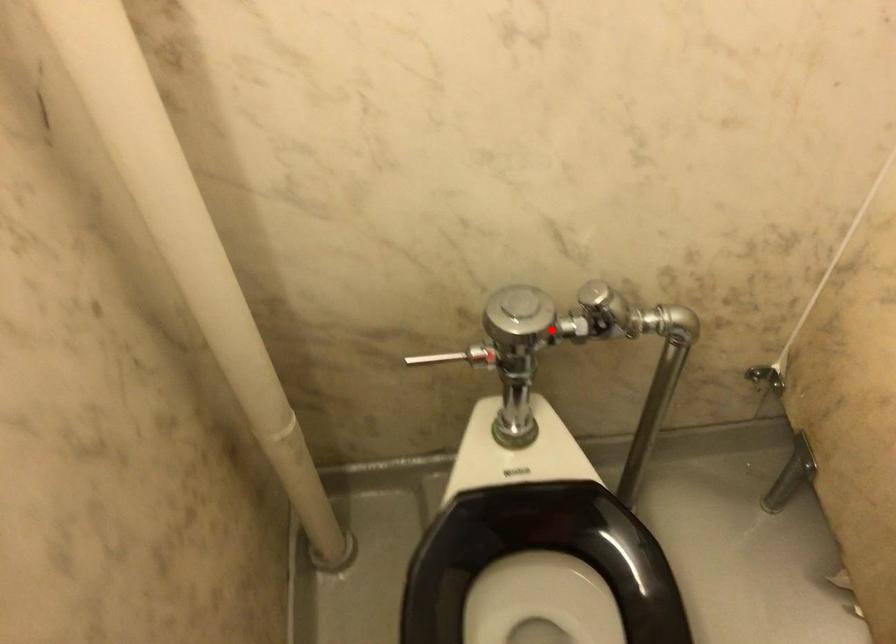
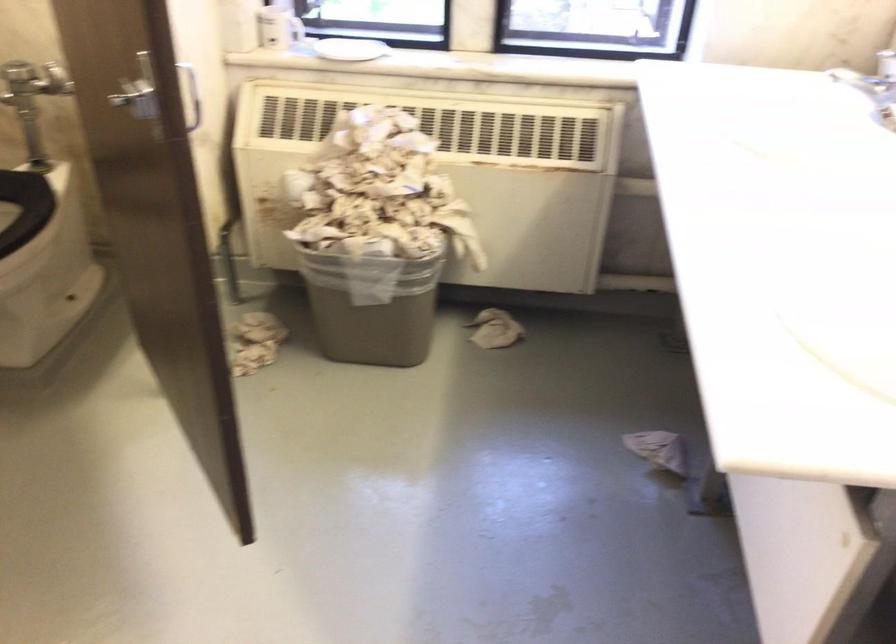
Question: I am providing you with two images of the same scene from different viewpoints. In image1, a red point is highlighted. Considering the same 3D point in image2, which of the following is correct?

Choices:
 (A) It is closer
 (B) It is farther

Answer: (B)